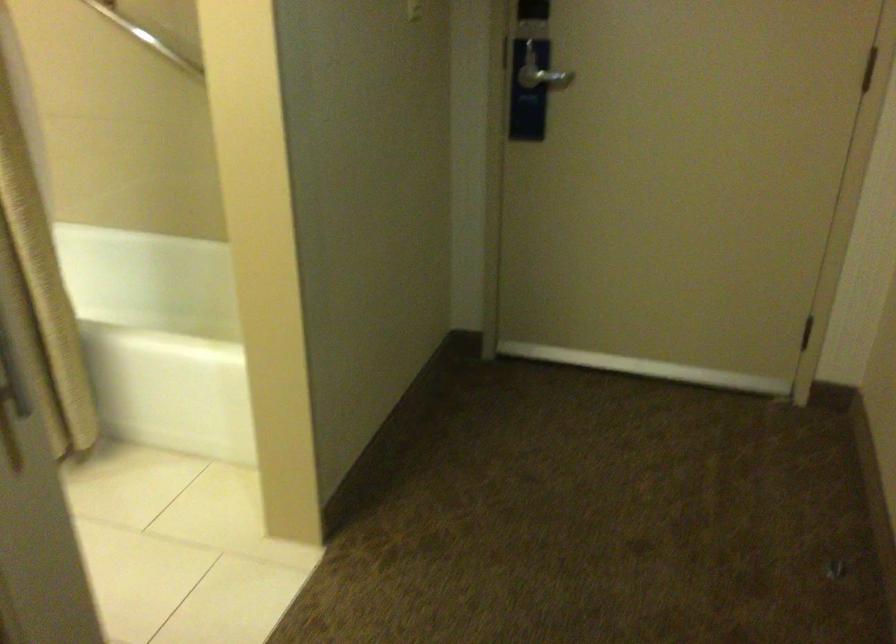
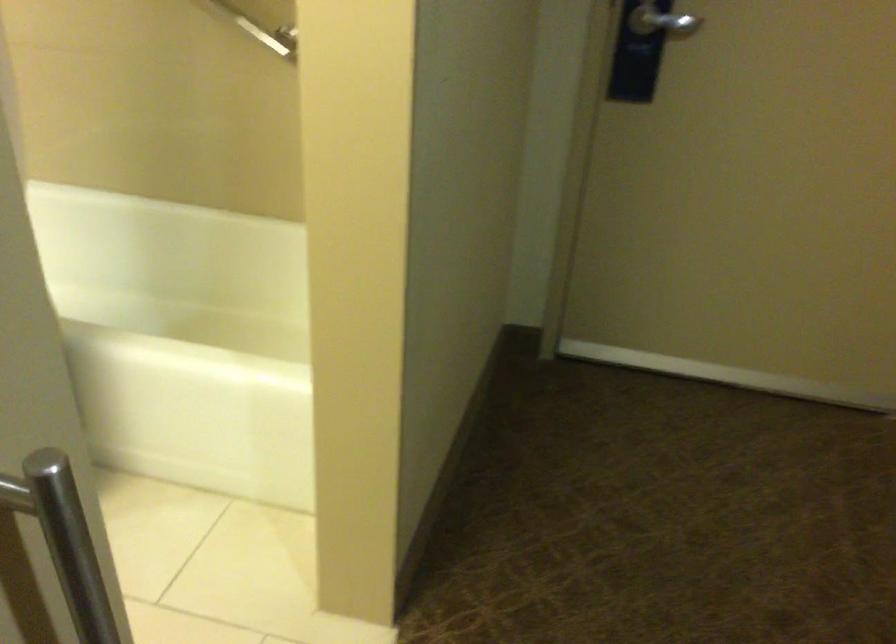
Question: How did the camera likely rotate?

Choices:
 (A) Left
 (B) Right
 (C) Up
 (D) Down

Answer: (D)